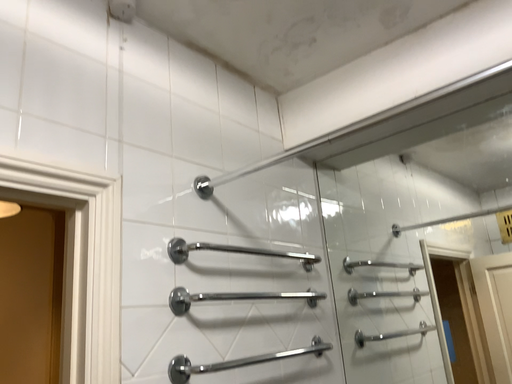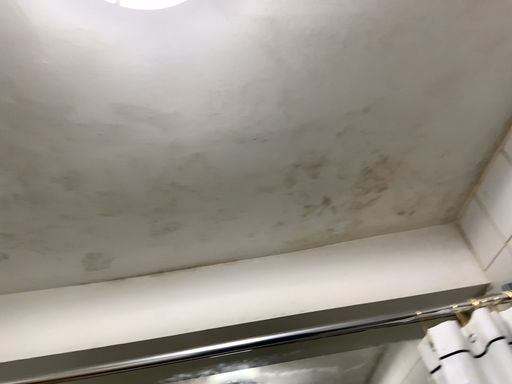
Question: How did the camera likely rotate when shooting the video?

Choices:
 (A) rotated left
 (B) rotated right

Answer: (B)